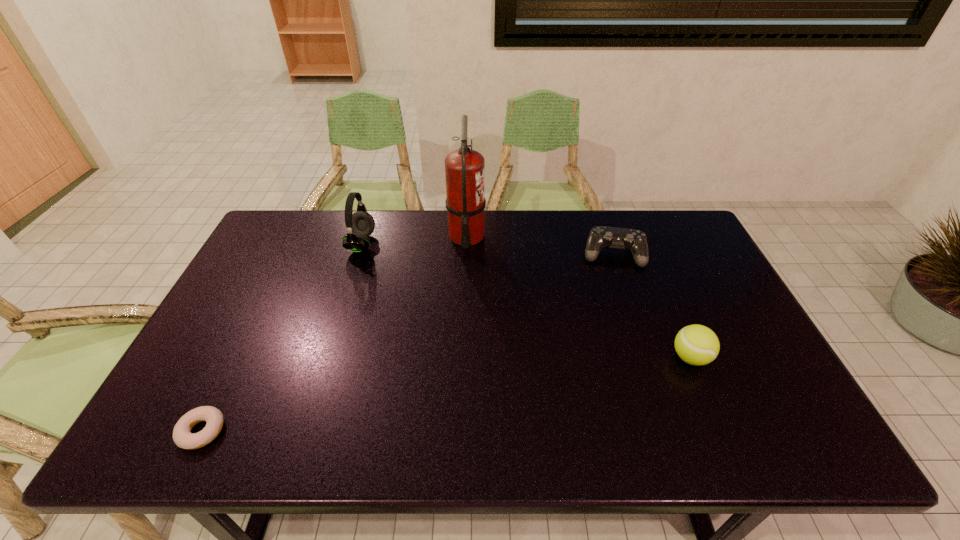
Identify the location of blank area in the image that satisfies the following two spatial constraints: 1. toward the nozzle of the third object from left to right; 2. on the right side of the tennis ball. (462, 357).

Identify the location of free space that satisfies the following two spatial constraints: 1. on the ear cups of the fourth farthest object; 2. on the left side of the fourth shortest object. This screenshot has height=540, width=960. (326, 357).

Locate an element on the screen. vacant position in the image that satisfies the following two spatial constraints: 1. toward the nozzle of the fire extinguisher; 2. on the back side of the fourth farthest object is located at coordinates (462, 357).

Identify the location of free region that satisfies the following two spatial constraints: 1. on the ear cups of the fourth shortest object; 2. on the left side of the fourth tallest object. (358, 255).

Image resolution: width=960 pixels, height=540 pixels. Find the location of `free space that satisfies the following two spatial constraints: 1. toward the nozzle of the tallest object; 2. on the right side of the control`. free space that satisfies the following two spatial constraints: 1. toward the nozzle of the tallest object; 2. on the right side of the control is located at coordinates (466, 255).